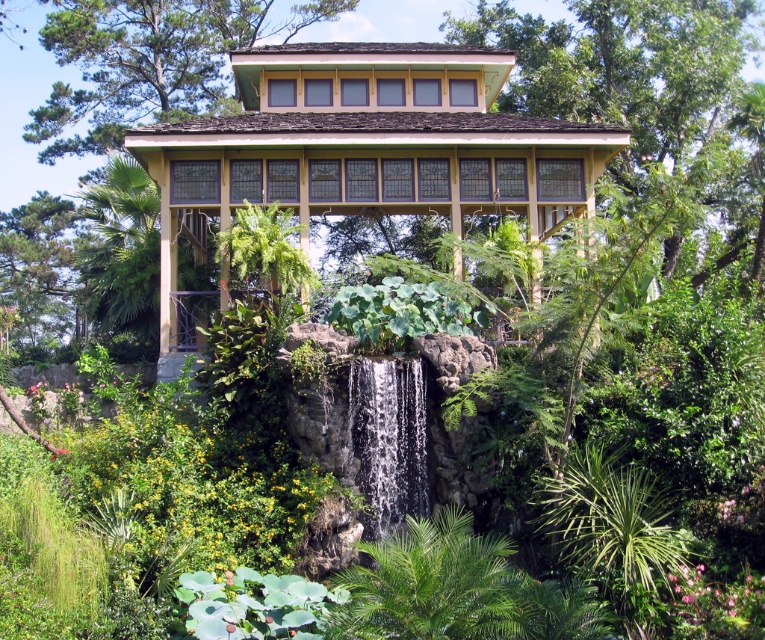
You are standing on the wooden path leading to the yellow wood gazebo at center and the clear water at center. Which one is physically higher in elevation?

The yellow wood gazebo at center is located above clear water at center, so the gazebo is higher in elevation.

You are planning to place a bench between the green leafy tree at center and the green leafy tree at upper center in the gazebo. Which tree has a wider spread that might require more space for the bench placement?

The green leafy tree at upper center has a wider spread than the green leafy tree at center, so placing the bench near it would require more space.

You are standing in the tropical garden and want to take a photo of the yellow wood gazebo at center. To avoid having the green leafy tree at upper center block the sunlight, where should you position yourself relative to the tree?

You should position yourself so that the green leafy tree at upper center is behind you relative to the yellow wood gazebo at center, as the gazebo is below the tree and you want the sunlight to come from behind the tree to avoid blocking.